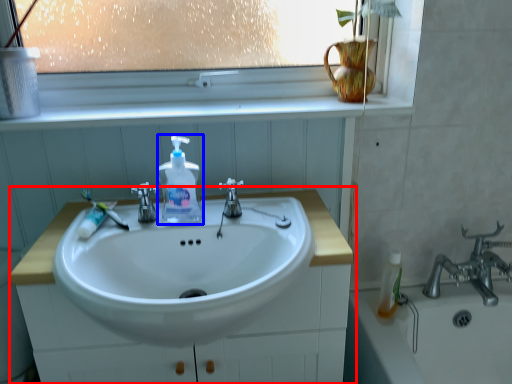
Question: Among these objects, which one is nearest to the camera, bathroom cabinet (highlighted by a red box) or soap dispenser (highlighted by a blue box)?

Choices:
 (A) bathroom cabinet
 (B) soap dispenser

Answer: (A)